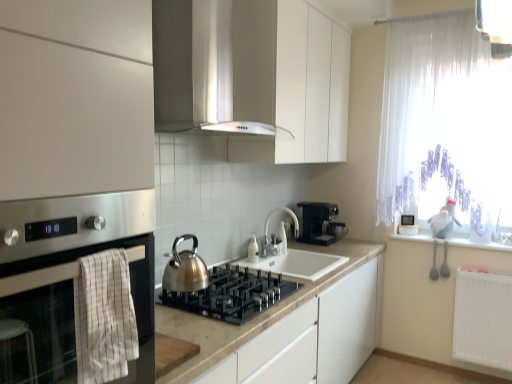
Question: Considering the relative sizes of black glass gas stove at center and white glossy sink at center in the image provided, is black glass gas stove at center smaller than white glossy sink at center?

Choices:
 (A) no
 (B) yes

Answer: (B)

Question: Is black glass gas stove at center completely or partially outside of white glossy sink at center?

Choices:
 (A) yes
 (B) no

Answer: (A)

Question: From the image's perspective, is black glass gas stove at center on white glossy sink at center?

Choices:
 (A) yes
 (B) no

Answer: (A)

Question: Is black glass gas stove at center next to white glossy sink at center and touching it?

Choices:
 (A) yes
 (B) no

Answer: (B)

Question: From the image's perspective, would you say black glass gas stove at center is shown under white glossy sink at center?

Choices:
 (A) yes
 (B) no

Answer: (B)

Question: Is black glass gas stove at center facing towards white glossy sink at center?

Choices:
 (A) yes
 (B) no

Answer: (B)

Question: Is stainless steel oven at left facing away from white matte cabinet at upper center?

Choices:
 (A) yes
 (B) no

Answer: (B)

Question: From a real-world perspective, is stainless steel oven at left beneath white matte cabinet at upper center?

Choices:
 (A) yes
 (B) no

Answer: (A)

Question: From a real-world perspective, is stainless steel oven at left on top of white matte cabinet at upper center?

Choices:
 (A) yes
 (B) no

Answer: (B)

Question: Is stainless steel oven at left at the left side of white matte cabinet at upper center?

Choices:
 (A) no
 (B) yes

Answer: (B)

Question: Is stainless steel oven at left positioned beyond the bounds of white matte cabinet at upper center?

Choices:
 (A) yes
 (B) no

Answer: (A)

Question: Does stainless steel oven at left turn towards white matte cabinet at upper center?

Choices:
 (A) no
 (B) yes

Answer: (A)

Question: Is black plastic coffee machine at center taller than white sheer curtain at right?

Choices:
 (A) no
 (B) yes

Answer: (A)